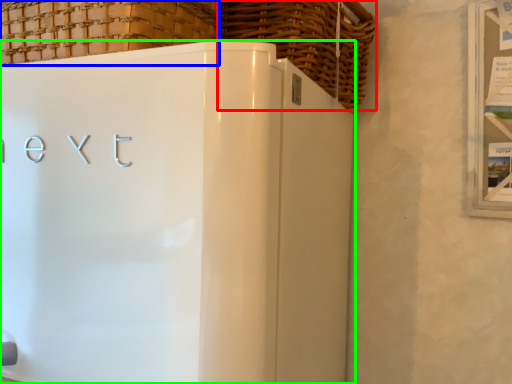
Question: Estimate the real-world distances between objects in this image. Which object is farther from basket (highlighted by a red box), basket (highlighted by a blue box) or refrigerator (highlighted by a green box)?

Choices:
 (A) basket
 (B) refrigerator

Answer: (B)